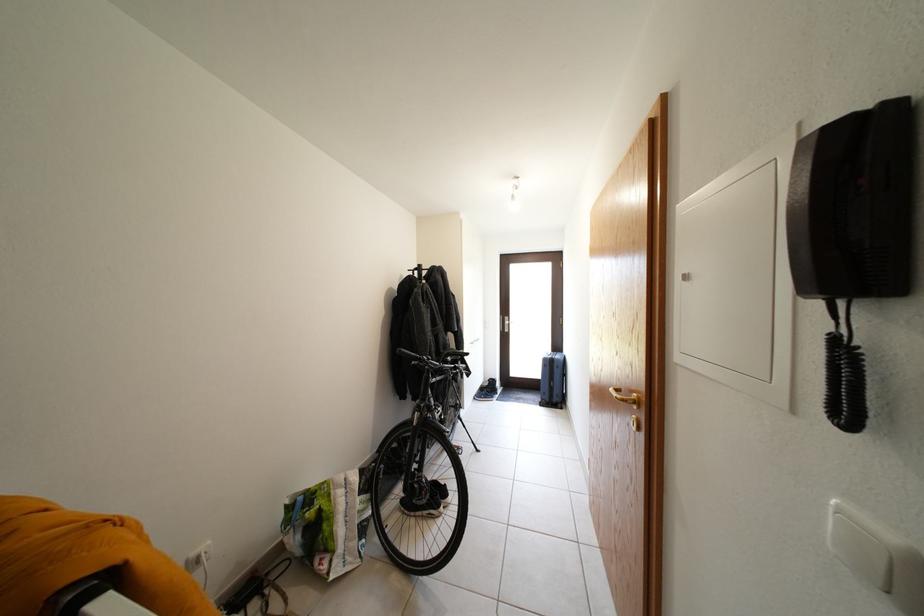
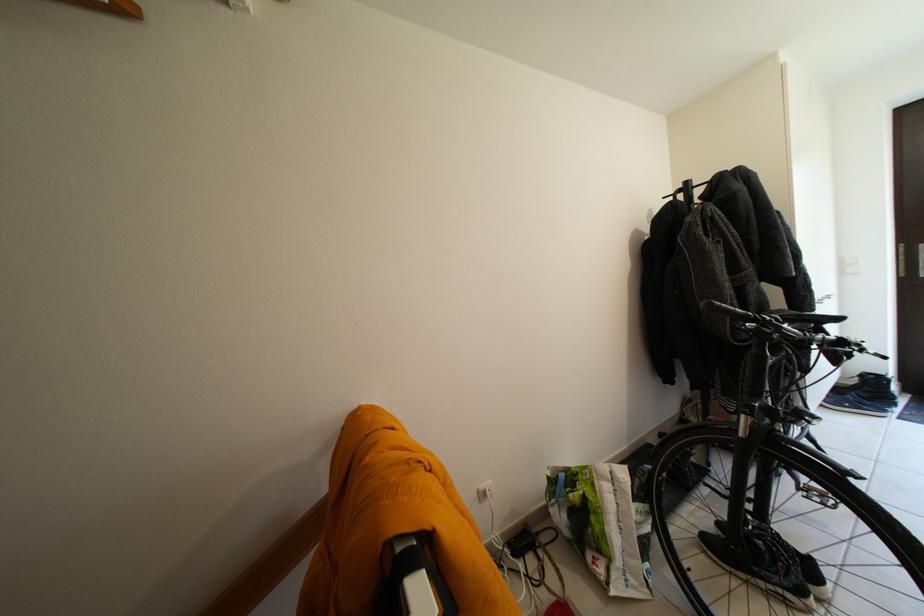
Where in the second image is the point corresponding to [491,394] from the first image?

(845, 395)